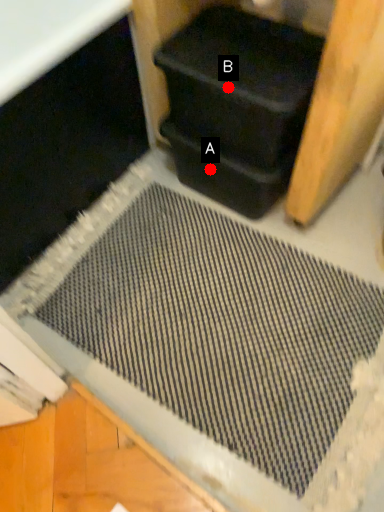
Question: Two points are circled on the image, labeled by A and B beside each circle. Which point appears closest to the camera in this image?

Choices:
 (A) A is closer
 (B) B is closer

Answer: (B)